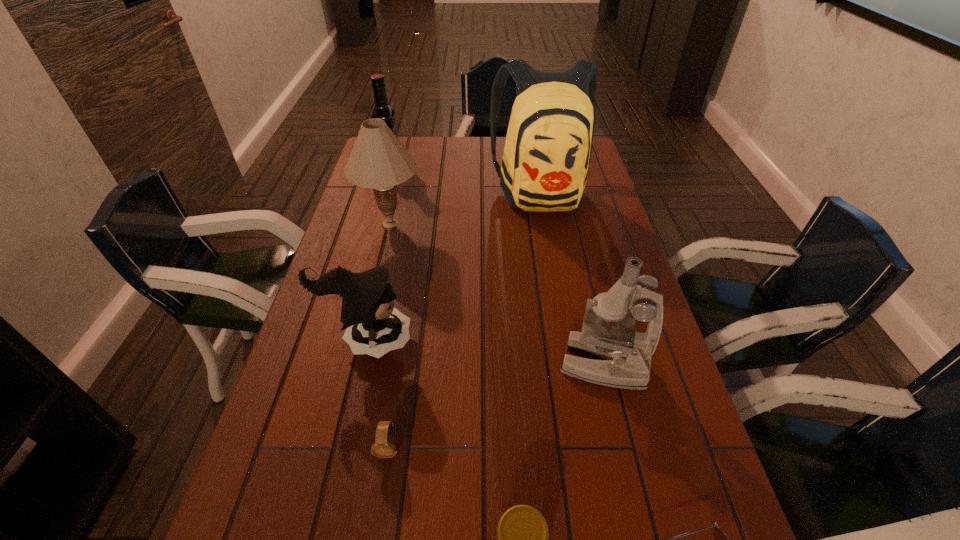
This screenshot has width=960, height=540. I want to click on object that is at the far left corner, so click(x=382, y=110).

Identify the location of object located in the far right corner section of the desktop. (548, 146).

Identify the location of free spot at the left edge of the desktop. The width and height of the screenshot is (960, 540). (294, 535).

Where is `vacant space at the right edge of the desktop`? vacant space at the right edge of the desktop is located at coordinates (605, 194).

This screenshot has width=960, height=540. What are the coordinates of `vacant point located between the liquor and the fourth shortest object` in the screenshot? It's located at (379, 252).

Where is `free area in between the seventh tallest object and the tallest object`? free area in between the seventh tallest object and the tallest object is located at coordinates (465, 319).

Locate an element on the screen. The image size is (960, 540). vacant region between the doll and the microscope is located at coordinates (485, 352).

The image size is (960, 540). I want to click on the fourth closest object to the spectacles, so click(374, 326).

At what (x,y) coordinates should I click in order to perform the action: click on object identified as the third closest to the lampshade. Please return your answer as a coordinate pair (x, y). This screenshot has height=540, width=960. Looking at the image, I should click on (374, 326).

Where is `vacant area in the image that satisfies the following two spatial constraints: 1. on the front-facing side of the backpack; 2. at the face of the fifth tallest object`? The image size is (960, 540). vacant area in the image that satisfies the following two spatial constraints: 1. on the front-facing side of the backpack; 2. at the face of the fifth tallest object is located at coordinates (568, 340).